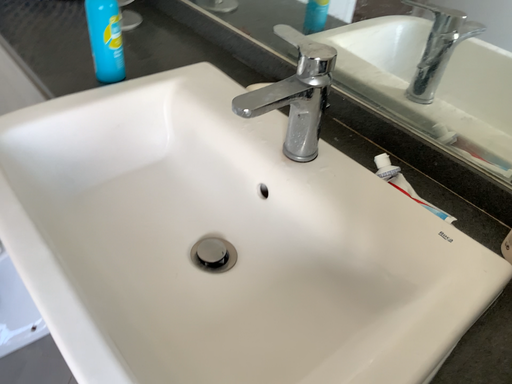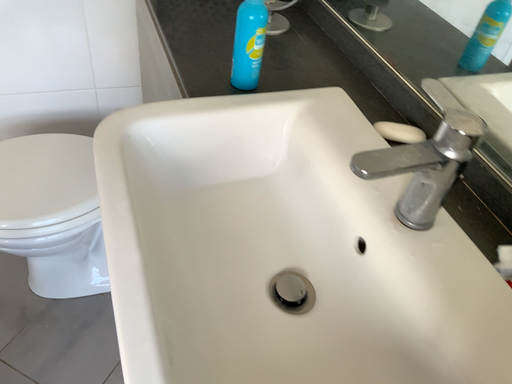
Question: Which way did the camera rotate in the video?

Choices:
 (A) rotated left
 (B) rotated right

Answer: (A)